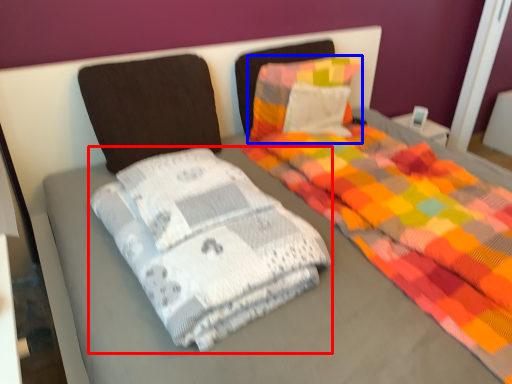
Question: Which point is closer to the camera, material (highlighted by a red box) or pillow (highlighted by a blue box)?

Choices:
 (A) material
 (B) pillow

Answer: (A)